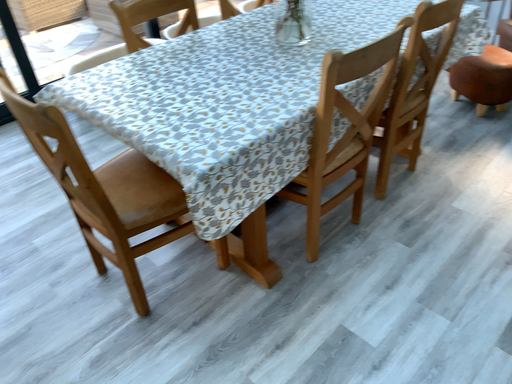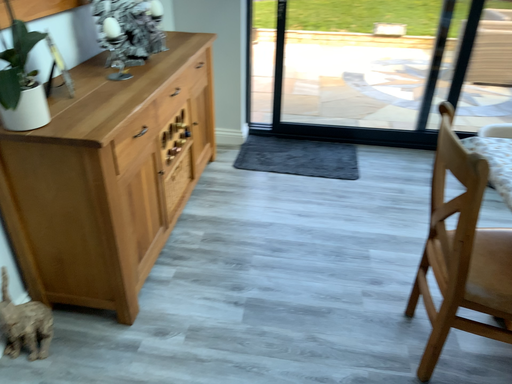
Question: How did the camera likely rotate when shooting the video?

Choices:
 (A) rotated upward
 (B) rotated downward

Answer: (A)